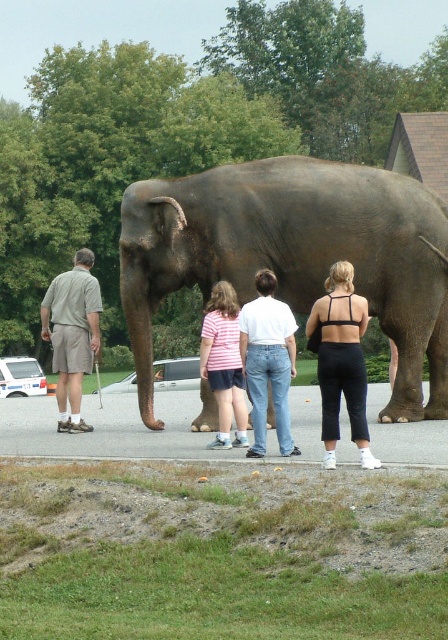
Question: Considering the real-world distances, which object is closest to the black matte pants at center?

Choices:
 (A) light brown shorts at left
 (B) gray textured elephant at center
 (C) striped cotton shirt at center
 (D) white cotton shirt at center

Answer: (D)

Question: Can you confirm if white cotton shirt at center is positioned below striped cotton shirt at center?

Choices:
 (A) no
 (B) yes

Answer: (A)

Question: Is light brown shorts at left to the right of striped cotton shirt at center from the viewer's perspective?

Choices:
 (A) yes
 (B) no

Answer: (B)

Question: Which object is positioned closest to the striped cotton shirt at center?

Choices:
 (A) black matte pants at center
 (B) light brown shorts at left
 (C) gray textured elephant at center
 (D) white cotton shirt at center

Answer: (D)

Question: Estimate the real-world distances between objects in this image. Which object is farther from the gray textured elephant at center?

Choices:
 (A) striped cotton shirt at center
 (B) black matte pants at center
 (C) light brown shorts at left
 (D) white cotton shirt at center

Answer: (B)

Question: From the image, what is the correct spatial relationship of gray textured elephant at center in relation to light brown shorts at left?

Choices:
 (A) below
 (B) above

Answer: (B)